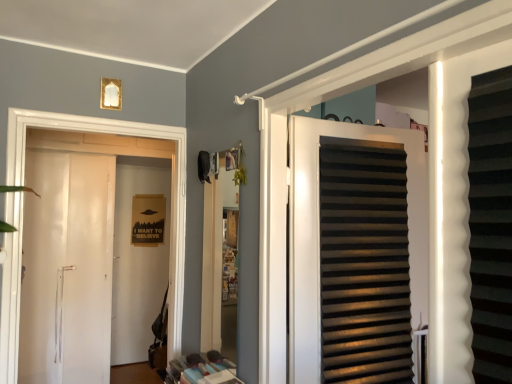
The height and width of the screenshot is (384, 512). Describe the element at coordinates (319, 227) in the screenshot. I see `matte black slats at center, which appears as the second door when viewed from the back` at that location.

What is the approximate height of matte black slats at center, the second door when ordered from left to right?

matte black slats at center, the second door when ordered from left to right, is 3.59 feet tall.

Locate an element on the screen. This screenshot has height=384, width=512. matte black slats at center, marked as the first door in a right-to-left arrangement is located at coordinates (319, 227).

In order to click on white glossy door at left, which is the 2th door from front to back in this screenshot , I will do `click(119, 137)`.

This screenshot has height=384, width=512. What do you see at coordinates (119, 137) in the screenshot?
I see `white glossy door at left, which is counted as the 1th door, starting from the left` at bounding box center [119, 137].

Where is `matte black slats at center, which appears as the second door when viewed from the back`? matte black slats at center, which appears as the second door when viewed from the back is located at coordinates (319, 227).

Which object is positioned more to the left, white glossy door at left, which is counted as the 2th door, starting from the right, or matte black slats at center, which appears as the second door when viewed from the back?

white glossy door at left, which is counted as the 2th door, starting from the right.

Does white glossy door at left, which is counted as the 2th door, starting from the right, lie behind matte black slats at center, the second door when ordered from left to right?

Yes, white glossy door at left, which is counted as the 2th door, starting from the right, is further from the viewer.

Is point (23, 124) closer to viewer compared to point (318, 291)?

No, (23, 124) is further to viewer.

Consider the image. From the image's perspective, which object appears higher, white glossy door at left, which is counted as the 1th door, starting from the left, or matte black slats at center, which appears as the second door when viewed from the back?

matte black slats at center, which appears as the second door when viewed from the back, from the image's perspective.

From a real-world perspective, which object stands above the other?

matte black slats at center, marked as the first door in a right-to-left arrangement, from a real-world perspective.

Is white glossy door at left, placed as the 1th door when sorted from back to front, wider than matte black slats at center, the second door when ordered from left to right?

Indeed, white glossy door at left, placed as the 1th door when sorted from back to front, has a greater width compared to matte black slats at center, the second door when ordered from left to right.

Is white glossy door at left, placed as the 1th door when sorted from back to front, shorter than matte black slats at center, the second door when ordered from left to right?

Incorrect, the height of white glossy door at left, placed as the 1th door when sorted from back to front, does not fall short of that of matte black slats at center, the second door when ordered from left to right.

Is white glossy door at left, which is counted as the 2th door, starting from the right, bigger or smaller than matte black slats at center, marked as the first door in a right-to-left arrangement?

In the image, white glossy door at left, which is counted as the 2th door, starting from the right, appears to be larger than matte black slats at center, marked as the first door in a right-to-left arrangement.

Do you think white glossy door at left, placed as the 1th door when sorted from back to front, is within matte black slats at center, the second door when ordered from left to right, or outside of it?

white glossy door at left, placed as the 1th door when sorted from back to front, is outside matte black slats at center, the second door when ordered from left to right.

Are white glossy door at left, which is counted as the 2th door, starting from the right, and matte black slats at center, which is the 1th door from front to back, far apart?

That's right, there is a large distance between white glossy door at left, which is counted as the 2th door, starting from the right, and matte black slats at center, which is the 1th door from front to back.

Is white glossy door at left, which is the 2th door from front to back, looking in the opposite direction of matte black slats at center, which appears as the second door when viewed from the back?

No.

How different are the orientations of white glossy door at left, which is the 2th door from front to back, and matte black slats at center, which is the 1th door from front to back, in degrees?

77.9 degrees separate the facing orientations of white glossy door at left, which is the 2th door from front to back, and matte black slats at center, which is the 1th door from front to back.

Measure the distance between white glossy door at left, which is counted as the 2th door, starting from the right, and matte black slats at center, the second door when ordered from left to right.

white glossy door at left, which is counted as the 2th door, starting from the right, is 3.58 feet from matte black slats at center, the second door when ordered from left to right.

Identify the location of door that is behind the matte black slats at center, which is the 1th door from front to back. This screenshot has height=384, width=512. (119, 137).

Which is more to the left, matte black slats at center, marked as the first door in a right-to-left arrangement, or white glossy door at left, which is counted as the 2th door, starting from the right?

white glossy door at left, which is counted as the 2th door, starting from the right.

Which object is closer to the camera, matte black slats at center, the second door when ordered from left to right, or white glossy door at left, which is the 2th door from front to back?

matte black slats at center, the second door when ordered from left to right, is in front.

Between point (413, 320) and point (58, 136), which one is positioned behind?

The point (58, 136) is behind.

From the image's perspective, is matte black slats at center, which appears as the second door when viewed from the back, over white glossy door at left, which is the 2th door from front to back?

Yes, from the image's perspective, matte black slats at center, which appears as the second door when viewed from the back, is above white glossy door at left, which is the 2th door from front to back.

From a real-world perspective, does matte black slats at center, the second door when ordered from left to right, stand above white glossy door at left, which is counted as the 2th door, starting from the right?

Indeed, from a real-world perspective, matte black slats at center, the second door when ordered from left to right, stands above white glossy door at left, which is counted as the 2th door, starting from the right.

Is matte black slats at center, which is the 1th door from front to back, wider or thinner than white glossy door at left, which is counted as the 1th door, starting from the left?

Considering their sizes, matte black slats at center, which is the 1th door from front to back, looks slimmer than white glossy door at left, which is counted as the 1th door, starting from the left.

Can you confirm if matte black slats at center, which appears as the second door when viewed from the back, is taller than white glossy door at left, which is counted as the 2th door, starting from the right?

Incorrect, the height of matte black slats at center, which appears as the second door when viewed from the back, is not larger of that of white glossy door at left, which is counted as the 2th door, starting from the right.

Does matte black slats at center, the second door when ordered from left to right, have a larger size compared to white glossy door at left, which is the 2th door from front to back?

Incorrect, matte black slats at center, the second door when ordered from left to right, is not larger than white glossy door at left, which is the 2th door from front to back.

Is white glossy door at left, which is counted as the 1th door, starting from the left, surrounded by matte black slats at center, which appears as the second door when viewed from the back?

No, white glossy door at left, which is counted as the 1th door, starting from the left, is located outside of matte black slats at center, which appears as the second door when viewed from the back.

Is matte black slats at center, the second door when ordered from left to right, with white glossy door at left, which is counted as the 1th door, starting from the left?

No, matte black slats at center, the second door when ordered from left to right, is not with white glossy door at left, which is counted as the 1th door, starting from the left.

Is matte black slats at center, which is the 1th door from front to back, facing towards white glossy door at left, which is counted as the 1th door, starting from the left?

No, matte black slats at center, which is the 1th door from front to back, is not aimed at white glossy door at left, which is counted as the 1th door, starting from the left.

How many degrees apart are the facing directions of matte black slats at center, which is the 1th door from front to back, and white glossy door at left, which is the 2th door from front to back?

They differ by 77.9 degrees in their facing directions.

Identify the location of door that appears in front of the white glossy door at left, which is counted as the 1th door, starting from the left. (319, 227).

Image resolution: width=512 pixels, height=384 pixels. What are the coordinates of `door that appears above the white glossy door at left, which is the 2th door from front to back (from the image's perspective)` in the screenshot? It's located at (319, 227).

The width and height of the screenshot is (512, 384). In the image, there is a matte black slats at center, which is the 1th door from front to back. In order to click on door below it (from the image's perspective) in this screenshot , I will do `click(119, 137)`.